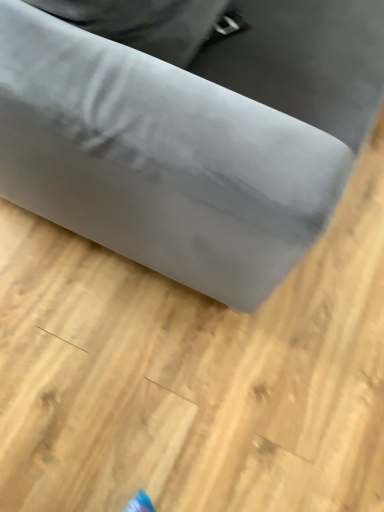
What do you see at coordinates (178, 150) in the screenshot? I see `suede gray couch at center` at bounding box center [178, 150].

The height and width of the screenshot is (512, 384). Identify the location of suede gray couch at center. (178, 150).

At what (x,y) coordinates should I click in order to perform the action: click on suede gray couch at center. Please return your answer as a coordinate pair (x, y). This screenshot has width=384, height=512. Looking at the image, I should click on 178,150.